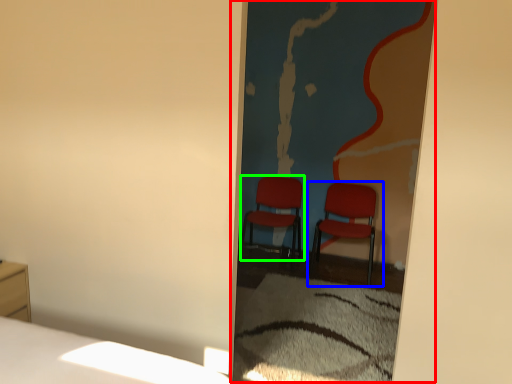
Question: Which object is the closest to the screen door (highlighted by a red box)? Choose among these: chair (highlighted by a blue box) or chair (highlighted by a green box).

Choices:
 (A) chair
 (B) chair

Answer: (A)